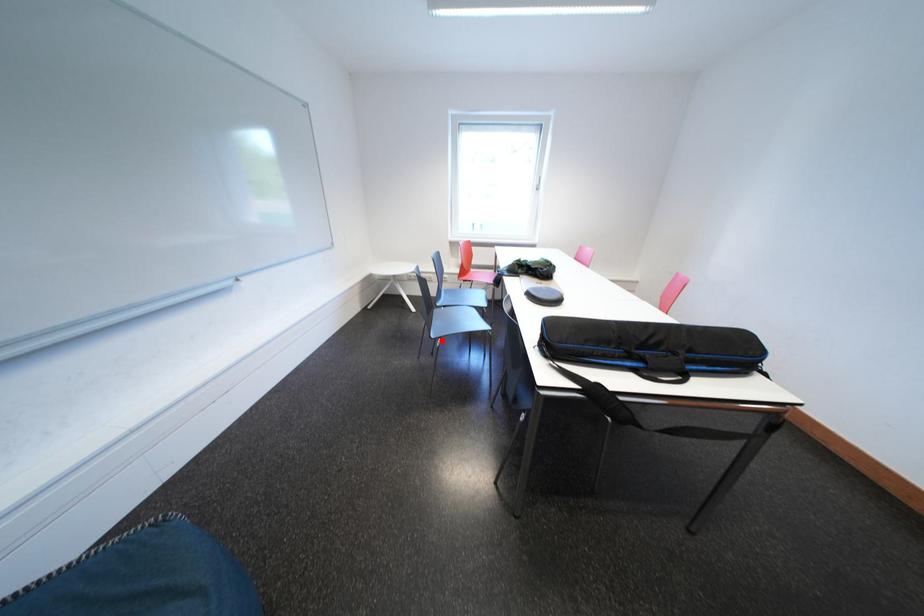
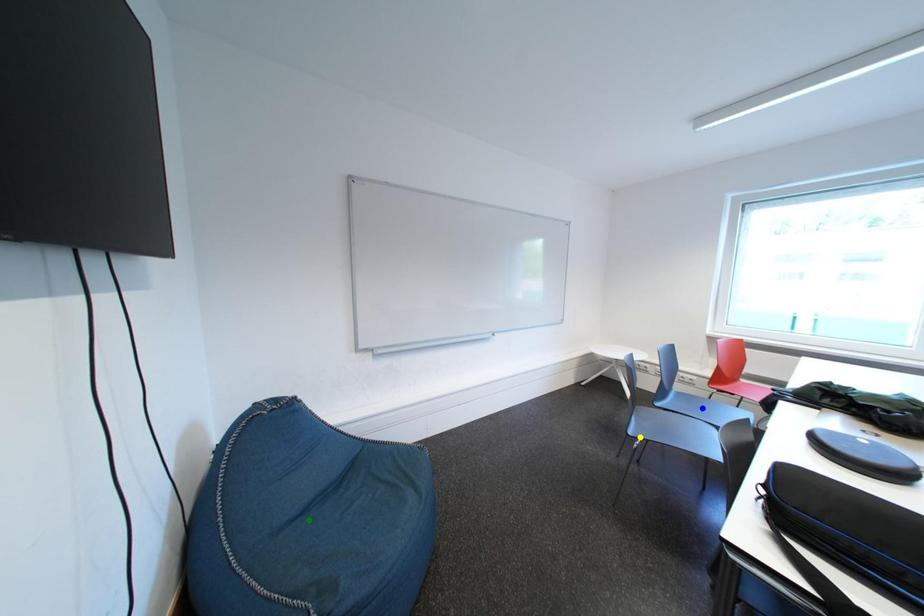
Question: I am providing you with two images of the same scene from different viewpoints. A red point is marked on the first image. You are given multiple points on the second image. In image 2, which mark is for the same physical point as the one in image 1?

Choices:
 (A) blue point
 (B) yellow point
 (C) green point

Answer: (B)